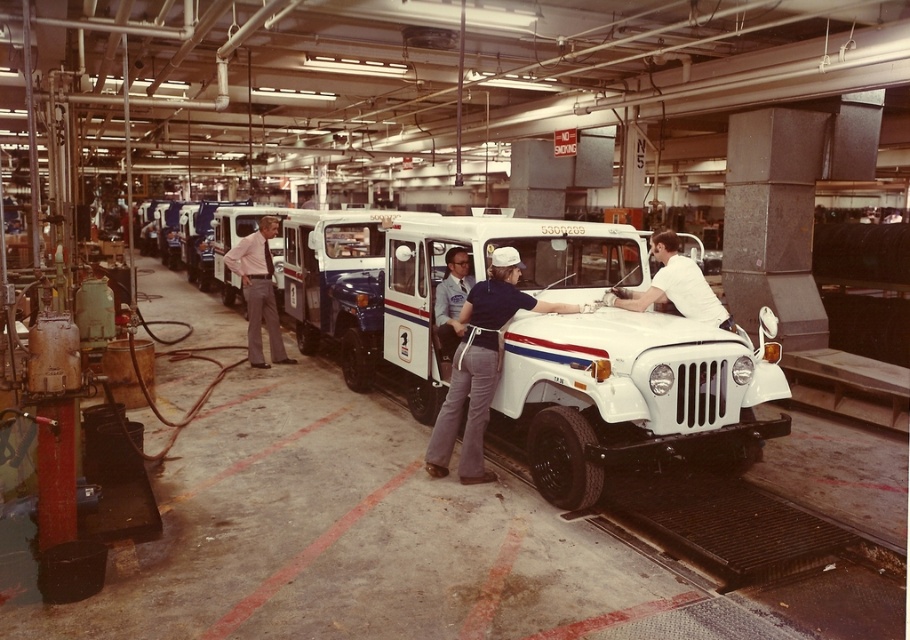
Is denim pants at center thinner than light pink shirt at center?

In fact, denim pants at center might be wider than light pink shirt at center.

Does denim pants at center appear over light pink shirt at center?

No.

Which is in front, point (568, 307) or point (256, 256)?

Point (568, 307) is more forward.

Locate an element on the screen. This screenshot has width=910, height=640. denim pants at center is located at coordinates (480, 364).